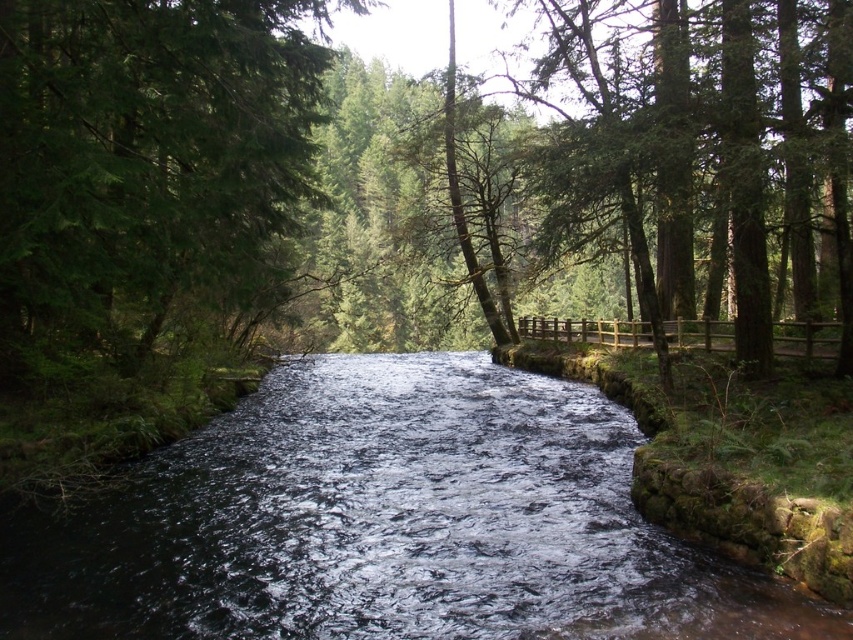
Does dark water at center appear on the right side of green textured tree at upper left?

Correct, you'll find dark water at center to the right of green textured tree at upper left.

Is dark water at center above green textured tree at upper left?

No.

Who is more forward, [809,634] or [109,257]?

Point [809,634] is more forward.

Identify the location of dark water at center. tap(387, 524).